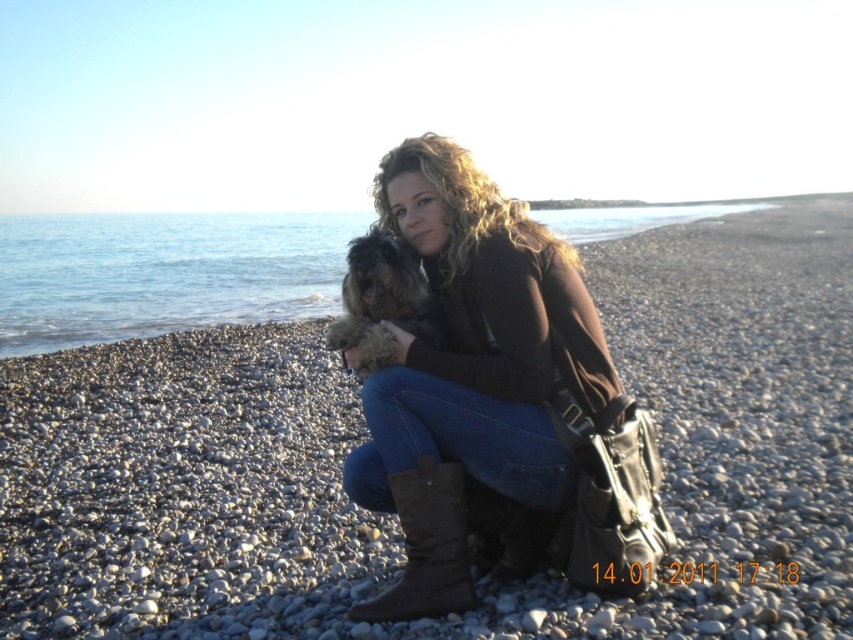
Question: Which object is positioned closest to the fuzzy brown dog at center?

Choices:
 (A) brown suede boot at lower center
 (B) pebble beach at center
 (C) brown suede boots at lower center

Answer: (C)

Question: Does brown suede boots at lower center have a larger size compared to fuzzy brown dog at center?

Choices:
 (A) no
 (B) yes

Answer: (B)

Question: Does brown suede boots at lower center lie in front of fuzzy brown dog at center?

Choices:
 (A) yes
 (B) no

Answer: (A)

Question: Can you confirm if brown suede boots at lower center is positioned to the left of fuzzy brown dog at center?

Choices:
 (A) no
 (B) yes

Answer: (A)

Question: Based on their relative distances, which object is nearer to the brown suede boots at lower center?

Choices:
 (A) fuzzy brown dog at center
 (B) brown suede boot at lower center

Answer: (B)

Question: Among these points, which one is farthest from the camera?

Choices:
 (A) (405, 531)
 (B) (459, 156)

Answer: (B)